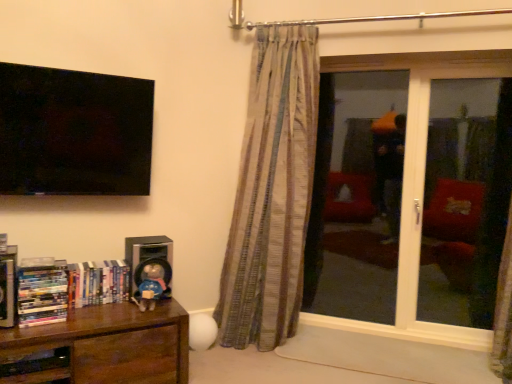
The height and width of the screenshot is (384, 512). Find the location of `blank space to the left of matte blue plush at lower left`. blank space to the left of matte blue plush at lower left is located at coordinates (113, 304).